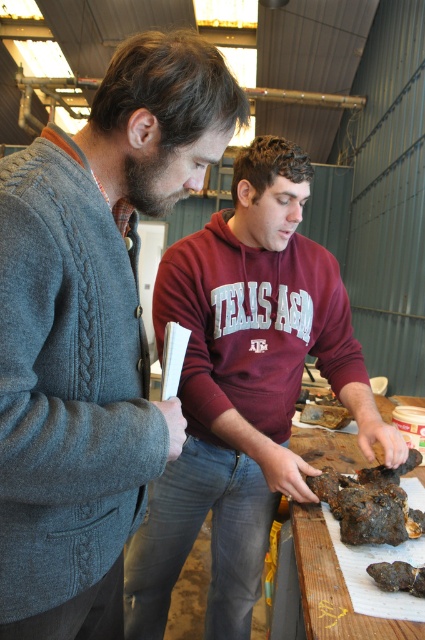
Can you confirm if maroon hoodie at center is positioned to the right of brown rough rock at lower center?

Incorrect, maroon hoodie at center is not on the right side of brown rough rock at lower center.

Between maroon hoodie at center and brown rough rock at lower center, which one has more height?

With more height is maroon hoodie at center.

Looking at this image, measure the distance between point (x=244, y=160) and camera.

Point (x=244, y=160) is 4.12 feet from camera.

At what (x,y) coordinates should I click in order to perform the action: click on maroon hoodie at center. Please return your answer as a coordinate pair (x, y). This screenshot has width=425, height=640. Looking at the image, I should click on (243, 388).

From the picture: Is wooden table at center bigger than brown rough rock at lower center?

Correct, wooden table at center is larger in size than brown rough rock at lower center.

Is wooden table at center to the left of brown rough rock at lower center from the viewer's perspective?

Incorrect, wooden table at center is not on the left side of brown rough rock at lower center.

Who is more forward, (295, 513) or (405, 586)?

Point (405, 586) is more forward.

Find the location of a particular element. wooden table at center is located at coordinates (333, 588).

Who is taller, gray knitted sweater at left or wooden table at center?

Standing taller between the two is gray knitted sweater at left.

Where is `gray knitted sweater at left`? gray knitted sweater at left is located at coordinates (91, 330).

This screenshot has width=425, height=640. I want to click on gray knitted sweater at left, so click(91, 330).